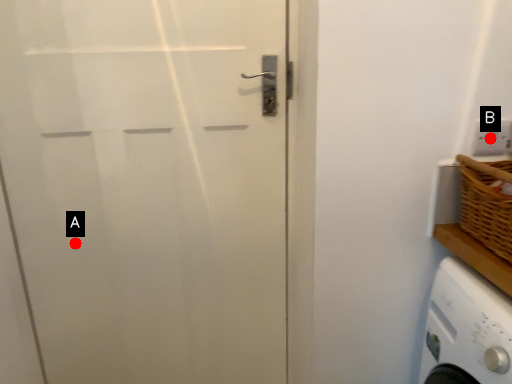
Question: Two points are circled on the image, labeled by A and B beside each circle. Among these points, which one is nearest to the camera?

Choices:
 (A) A is closer
 (B) B is closer

Answer: (B)